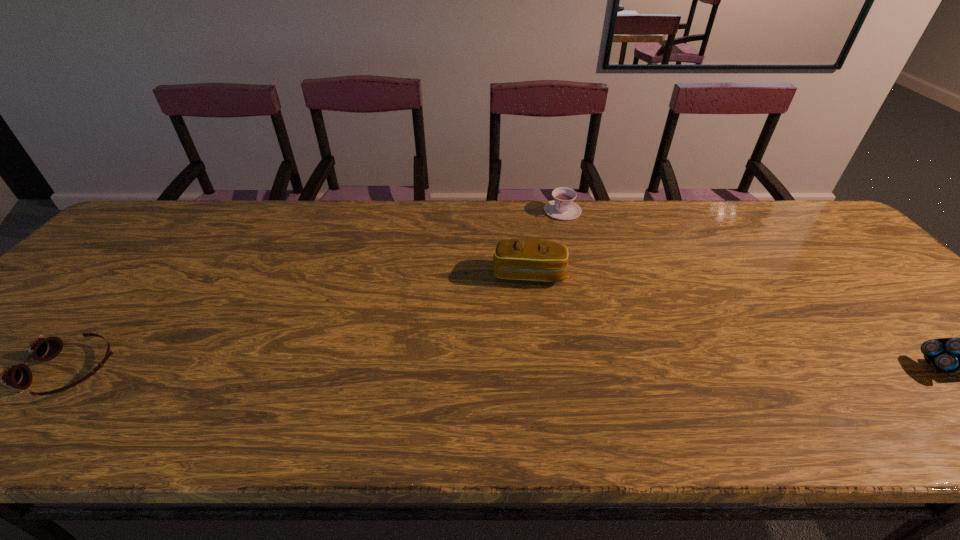
What are the coordinates of `vacant space in between the third nearest object and the leftmost object` in the screenshot? It's located at (300, 322).

Locate an element on the screen. empty space between the goggles and the third nearest object is located at coordinates (300, 322).

Where is `free space between the shortest object and the teacup`? This screenshot has height=540, width=960. free space between the shortest object and the teacup is located at coordinates (317, 291).

Where is `object that can be found as the third closest to the rightmost object`? This screenshot has height=540, width=960. object that can be found as the third closest to the rightmost object is located at coordinates (19, 376).

Identify which object is the nearest to the leftmost object. Please provide its 2D coordinates. Your answer should be formatted as a tuple, i.e. [(x, y)], where the tuple contains the x and y coordinates of a point satisfying the conditions above.

[(536, 260)]